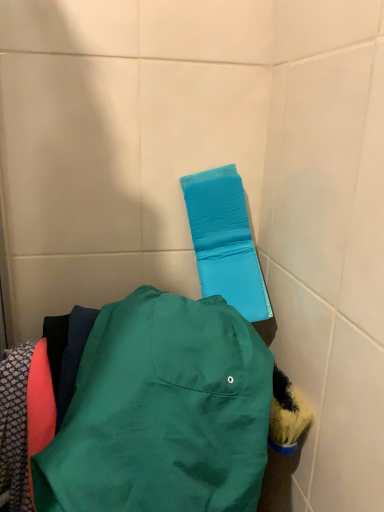
Describe the element at coordinates (225, 241) in the screenshot. I see `blue fabric towel bar at upper center` at that location.

At what (x,y) coordinates should I click in order to perform the action: click on blue fabric towel bar at upper center. Please return your answer as a coordinate pair (x, y). The width and height of the screenshot is (384, 512). Looking at the image, I should click on (225, 241).

Find the location of `matte green jacket at center`. matte green jacket at center is located at coordinates (162, 412).

The image size is (384, 512). Describe the element at coordinates (162, 412) in the screenshot. I see `matte green jacket at center` at that location.

I want to click on blue fabric towel bar at upper center, so click(225, 241).

Can you confirm if blue fabric towel bar at upper center is positioned to the left of matte green jacket at center?

No, blue fabric towel bar at upper center is not to the left of matte green jacket at center.

Is the position of blue fabric towel bar at upper center less distant than that of matte green jacket at center?

No, it is behind matte green jacket at center.

Which point is more distant from viewer, (208, 248) or (73, 503)?

The point (208, 248) is more distant.

From the image's perspective, which one is positioned lower, blue fabric towel bar at upper center or matte green jacket at center?

matte green jacket at center appears lower in the image.

From a real-world perspective, between blue fabric towel bar at upper center and matte green jacket at center, who is vertically higher?

blue fabric towel bar at upper center, from a real-world perspective.

Can you confirm if blue fabric towel bar at upper center is thinner than matte green jacket at center?

Correct, the width of blue fabric towel bar at upper center is less than that of matte green jacket at center.

Which of these two, blue fabric towel bar at upper center or matte green jacket at center, stands taller?

Standing taller between the two is blue fabric towel bar at upper center.

Does blue fabric towel bar at upper center have a smaller size compared to matte green jacket at center?

Yes.

In the scene shown: Do you think blue fabric towel bar at upper center is within matte green jacket at center, or outside of it?

blue fabric towel bar at upper center is located beyond the bounds of matte green jacket at center.

Is blue fabric towel bar at upper center touching matte green jacket at center?

No, blue fabric towel bar at upper center is not touching matte green jacket at center.

Is blue fabric towel bar at upper center aimed at matte green jacket at center?

Yes, blue fabric towel bar at upper center is oriented towards matte green jacket at center.

How many degrees apart are the facing directions of blue fabric towel bar at upper center and matte green jacket at center?

0.000134 degrees separate the facing orientations of blue fabric towel bar at upper center and matte green jacket at center.

In order to click on jacket on the left side of blue fabric towel bar at upper center in this screenshot , I will do click(x=162, y=412).

Does matte green jacket at center appear on the left side of blue fabric towel bar at upper center?

Yes.

Consider the image. Which object is closer to the camera, matte green jacket at center or blue fabric towel bar at upper center?

matte green jacket at center.

Does point (201, 450) lie behind point (238, 267)?

That is False.

From the image's perspective, which one is positioned lower, matte green jacket at center or blue fabric towel bar at upper center?

From the image's view, matte green jacket at center is below.

From a real-world perspective, is matte green jacket at center located beneath blue fabric towel bar at upper center?

Yes.

Is matte green jacket at center wider or thinner than blue fabric towel bar at upper center?

matte green jacket at center is wider than blue fabric towel bar at upper center.

Is matte green jacket at center taller than blue fabric towel bar at upper center?

In fact, matte green jacket at center may be shorter than blue fabric towel bar at upper center.

Is matte green jacket at center smaller than blue fabric towel bar at upper center?

Actually, matte green jacket at center might be larger than blue fabric towel bar at upper center.

Is matte green jacket at center outside of blue fabric towel bar at upper center?

That's correct, matte green jacket at center is outside of blue fabric towel bar at upper center.

Is matte green jacket at center far from blue fabric towel bar at upper center?

matte green jacket at center is actually quite close to blue fabric towel bar at upper center.

Is matte green jacket at center facing towards blue fabric towel bar at upper center?

No, matte green jacket at center is not oriented towards blue fabric towel bar at upper center.

How much distance is there between matte green jacket at center and blue fabric towel bar at upper center?

A distance of 23.05 centimeters exists between matte green jacket at center and blue fabric towel bar at upper center.

Image resolution: width=384 pixels, height=512 pixels. I want to click on jacket below the blue fabric towel bar at upper center (from a real-world perspective), so click(162, 412).

The width and height of the screenshot is (384, 512). I want to click on jacket lying below the blue fabric towel bar at upper center (from the image's perspective), so click(x=162, y=412).

This screenshot has width=384, height=512. Identify the location of towel bar above the matte green jacket at center (from the image's perspective). (225, 241).